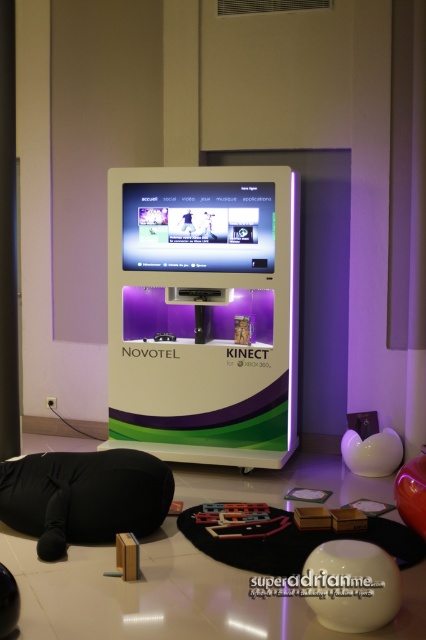
You are a guest at the Novotel hotel and want to sit down while using the kiosk. You see the matte plastic vending machine at center and the black fabric bean bag at lower left. Which object is closer to you, and can you sit on it?

The matte plastic vending machine at center is closer to you than the black fabric bean bag at lower left. However, the black fabric bean bag at lower left is designed for sitting, so you should sit on that.

You are a hotel guest who wants to sit comfortably while using the vending machine. The black fabric bean bag at lower left is nearby. Can you reach the matte plastic vending machine at center from the bean bag without moving from your seat?

The distance between the matte plastic vending machine at center and the black fabric bean bag at lower left is 4.30 feet, so yes, you can comfortably reach the matte plastic vending machine at center from the bean bag without needing to move from your seat since 4.30 feet is a short distance for reaching.